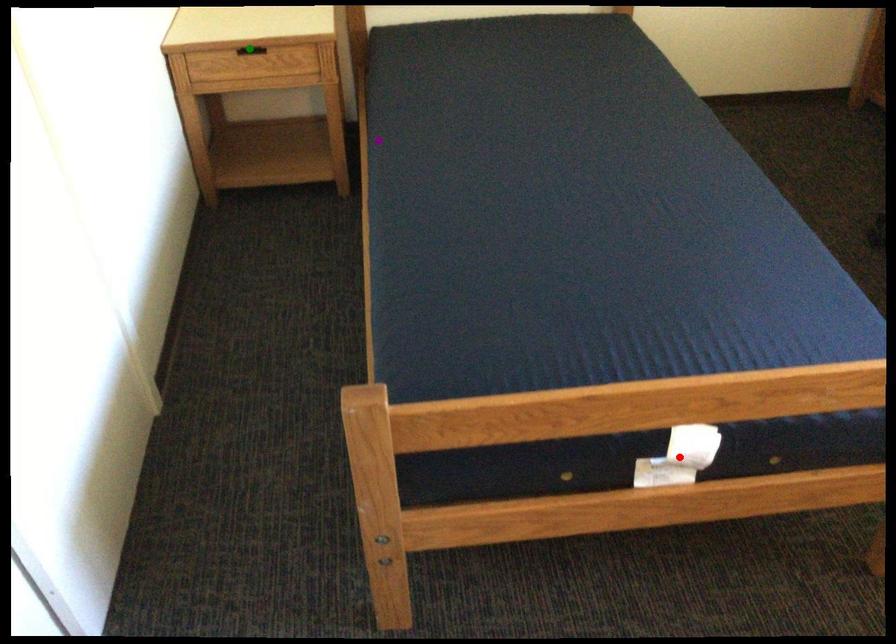
Order these from nearest to farthest:
- purple point
- red point
- green point

red point, green point, purple point